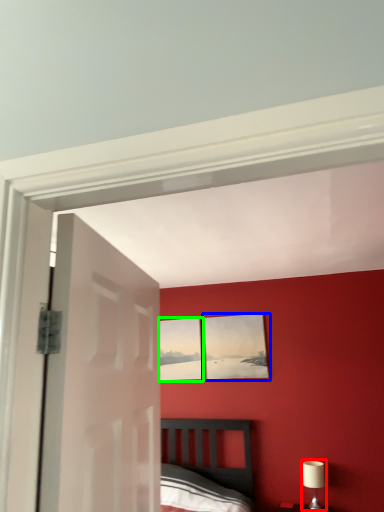
Question: Based on their relative distances, which object is farther from table lamp (highlighted by a red box)? Choose from picture frame (highlighted by a blue box) and picture frame (highlighted by a green box).

Choices:
 (A) picture frame
 (B) picture frame

Answer: (B)